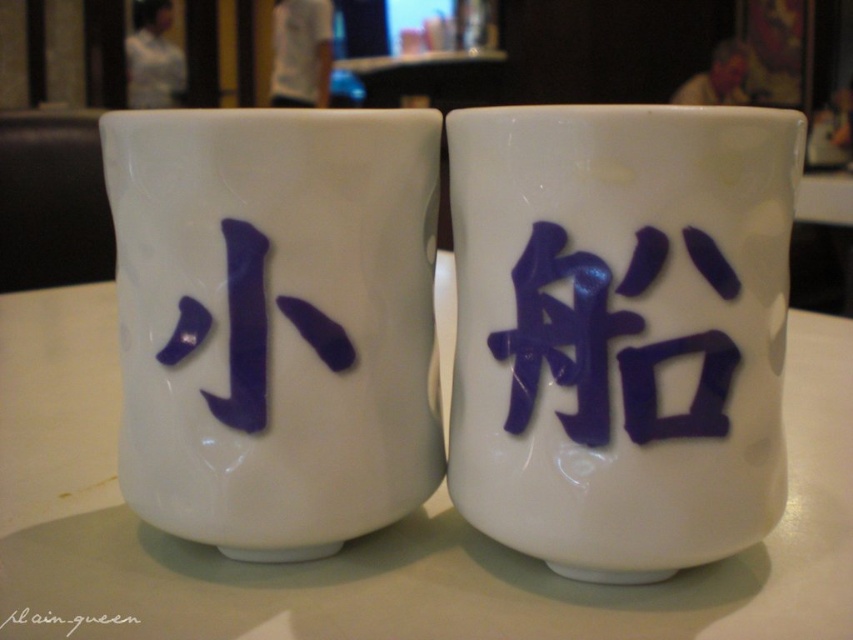
You are a customer in a cafe and you want to pick up the glossy ceramic mug at upper center and the matte white mug at center. Which mug should you reach for first if you want to grab the one closer to you?

The glossy ceramic mug at upper center is closer to the viewer than the matte white mug at center, so you should reach for the glossy ceramic mug at upper center first.

You are a barista who needs to prepare a hot drink for a customer. You have two items on the table in front of you, the matte white mug at center and the black ink signature at center. Which item can you use to serve the hot drink?

The matte white mug at center is larger in size than the black ink signature at center, so you can use the matte white mug at center to serve the hot drink.

You are a barista preparing drinks and notice two items on the counter. You need to place a tall glass between them. Which item should you place it next to, the matte white mug at center or the black ink signature at center, to ensure the glass fits vertically?

The matte white mug at center has a greater height compared to the black ink signature at center, so placing the tall glass next to the matte white mug at center would allow it to fit vertically without obstruction.